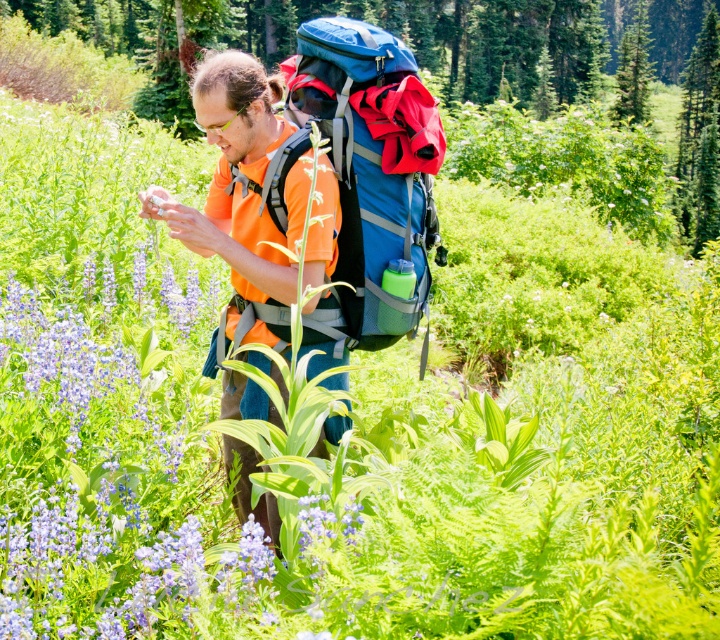
Question: Which of the following is the farthest from the observer?

Choices:
 (A) (390, 164)
 (B) (0, 288)

Answer: (B)

Question: Does purple matte flower at center-left appear under blue fabric backpack at center?

Choices:
 (A) yes
 (B) no

Answer: (A)

Question: Which point is closer to the camera taking this photo?

Choices:
 (A) (171, 372)
 (B) (413, 321)

Answer: (B)

Question: Is purple matte flower at center-left to the left of blue fabric backpack at center from the viewer's perspective?

Choices:
 (A) yes
 (B) no

Answer: (A)

Question: Among these points, which one is farthest from the camera?

Choices:
 (A) (374, 29)
 (B) (45, 580)

Answer: (A)

Question: Can you confirm if purple matte flower at center-left is positioned to the right of blue fabric backpack at center?

Choices:
 (A) no
 (B) yes

Answer: (A)